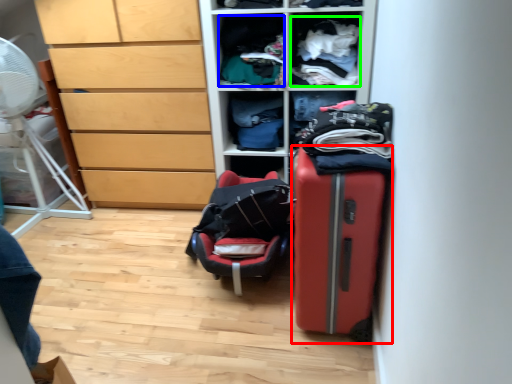
Question: Based on their relative distances, which object is nearer to suitcase (highlighted by a red box)? Choose from clothing (highlighted by a blue box) and clothing (highlighted by a green box).

Choices:
 (A) clothing
 (B) clothing

Answer: (B)